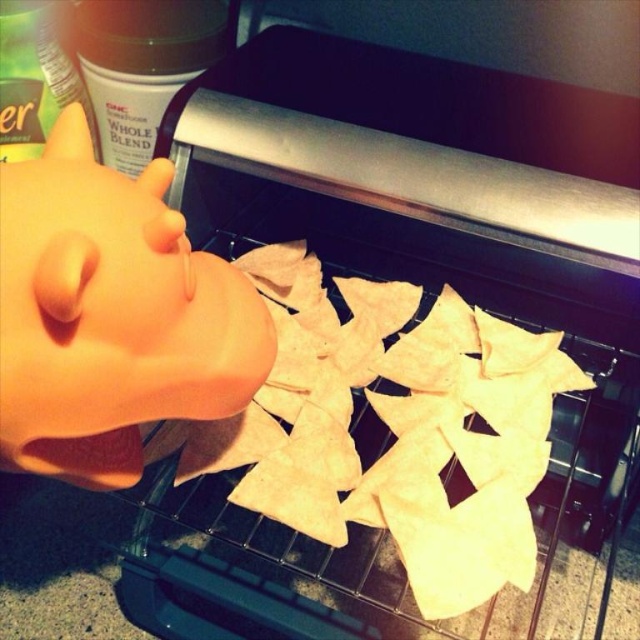
Question: Which point is farther from the camera taking this photo?

Choices:
 (A) (252, 340)
 (B) (243, 264)

Answer: (B)

Question: Is light brown tortilla chips at center to the left of matte plastic head at left from the viewer's perspective?

Choices:
 (A) yes
 (B) no

Answer: (B)

Question: Is light brown tortilla chips at center positioned before matte plastic head at left?

Choices:
 (A) yes
 (B) no

Answer: (B)

Question: Which object appears farthest from the camera in this image?

Choices:
 (A) matte plastic head at left
 (B) light brown tortilla chips at center

Answer: (B)

Question: Where is light brown tortilla chips at center located in relation to matte plastic head at left in the image?

Choices:
 (A) right
 (B) left

Answer: (A)